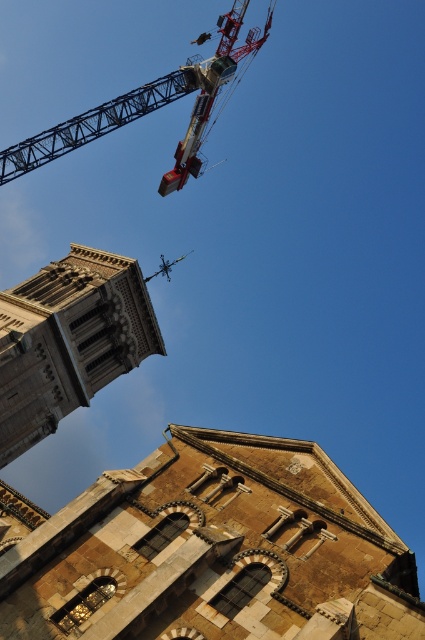
Question: Considering the real-world distances, which object is farthest from the metallic gray crane at upper center?

Choices:
 (A) stone tower at center
 (B) brown stone tower at center

Answer: (B)

Question: Among these objects, which one is nearest to the camera?

Choices:
 (A) metallic gray crane at upper center
 (B) brown stone tower at center

Answer: (B)

Question: Can you confirm if brown stone tower at center is positioned above stone tower at center?

Choices:
 (A) no
 (B) yes

Answer: (A)

Question: Is brown stone tower at center further to camera compared to metallic gray crane at upper center?

Choices:
 (A) yes
 (B) no

Answer: (B)

Question: Which of these objects is positioned closest to the brown stone tower at center?

Choices:
 (A) metallic gray crane at upper center
 (B) stone tower at center

Answer: (B)

Question: Does stone tower at center come behind metallic gray crane at upper center?

Choices:
 (A) no
 (B) yes

Answer: (A)